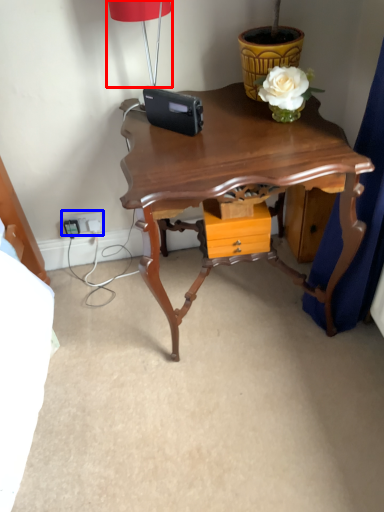
Question: Which of the following is the farthest to the observer, lamp (highlighted by a red box) or electric outlet (highlighted by a blue box)?

Choices:
 (A) lamp
 (B) electric outlet

Answer: (B)